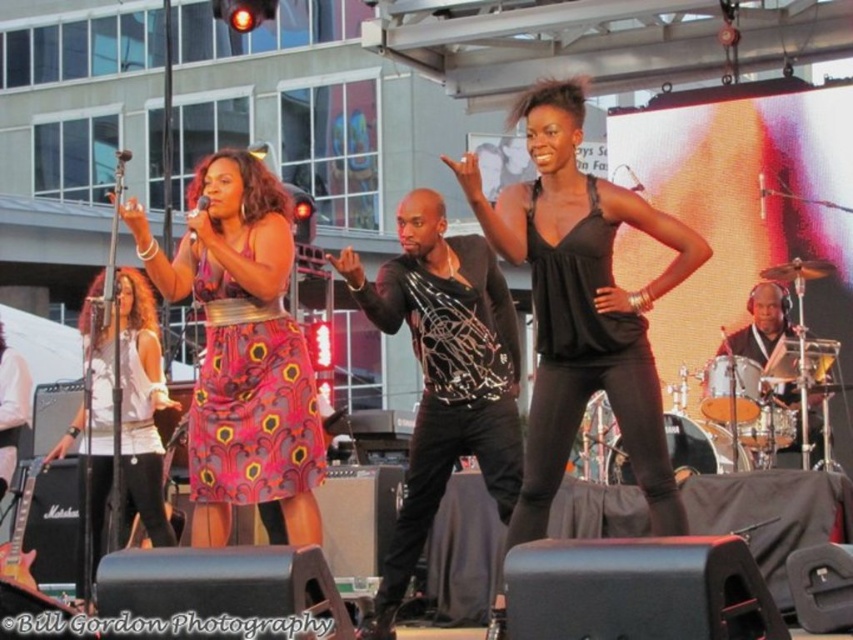
Describe the element at coordinates (581, 305) in the screenshot. I see `black matte tank top at center` at that location.

Is point (535, 474) positioned behind point (218, 452)?

No, (535, 474) is in front of (218, 452).

Locate an element on the screen. This screenshot has width=853, height=640. black matte tank top at center is located at coordinates (581, 305).

Can you confirm if black matte tank top at center is positioned above shiny black drum set at right?

A: Correct, black matte tank top at center is located above shiny black drum set at right.

Is point (566, 314) closer to camera compared to point (796, 336)?

Yes, it is in front of point (796, 336).

I want to click on black matte tank top at center, so pos(581,305).

Can you confirm if pink printed dress at center is positioned to the left of shiny black drum set at right?

Yes, pink printed dress at center is to the left of shiny black drum set at right.

Is pink printed dress at center below shiny black drum set at right?

Actually, pink printed dress at center is above shiny black drum set at right.

This screenshot has height=640, width=853. What do you see at coordinates (242, 349) in the screenshot? I see `pink printed dress at center` at bounding box center [242, 349].

You are a GUI agent. You are given a task and a screenshot of the screen. Output one action in this format:
    pyautogui.click(x=<x>, y=<y>)
    Task: Click on the pink printed dress at center
    
    Given the screenshot: What is the action you would take?
    pyautogui.click(x=242, y=349)